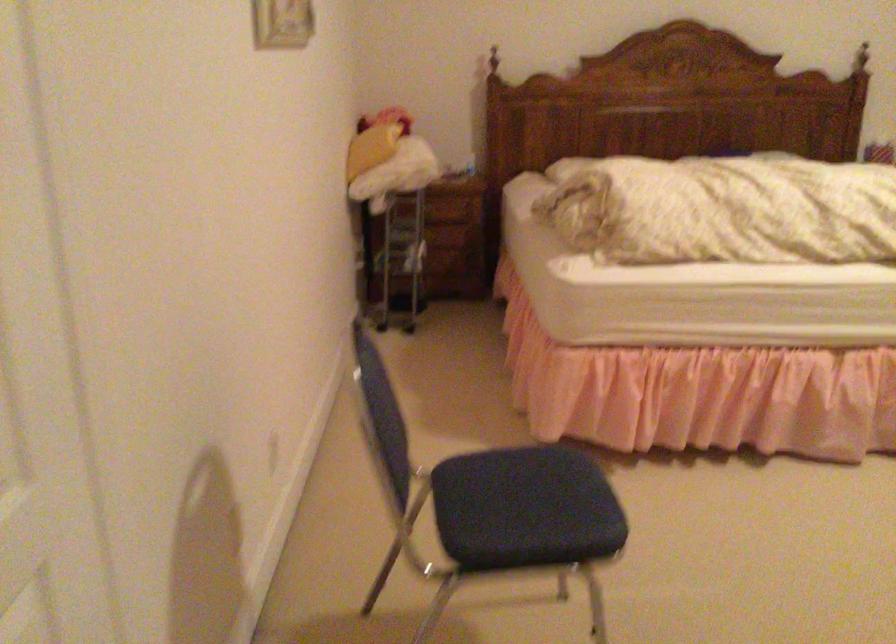
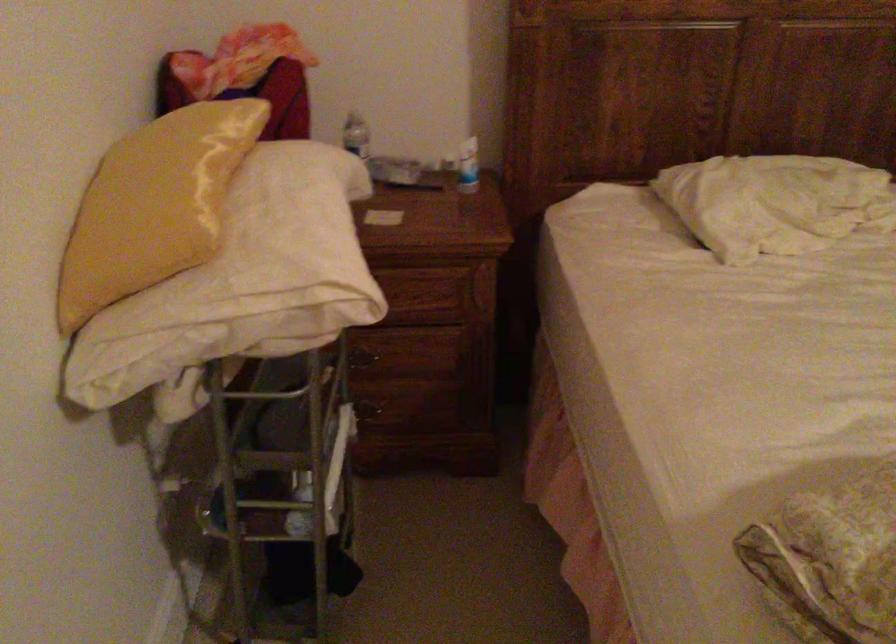
Locate, in the second image, the point that corresponds to point (583, 158) in the first image.

(774, 202)